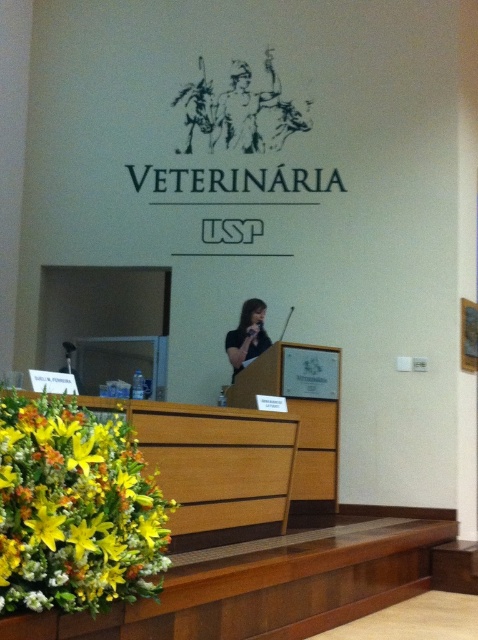
Who is higher up, vibrant floral arrangement at lower left or black matte shirt at center?

Positioned higher is black matte shirt at center.

Between point (94, 486) and point (241, 336), which one is positioned behind?

The point (241, 336) is behind.

Between point (0, 481) and point (227, 348), which one is positioned in front?

Point (0, 481) is more forward.

You are a GUI agent. You are given a task and a screenshot of the screen. Output one action in this format:
    pyautogui.click(x=<x>, y=<y>)
    Task: Click on the vibrant floral arrangement at lower left
    This screenshot has width=478, height=640.
    Given the screenshot: What is the action you would take?
    pyautogui.click(x=75, y=509)